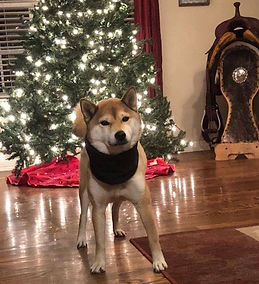
Locate an element on the screen. The width and height of the screenshot is (259, 284). wall is located at coordinates (182, 86).